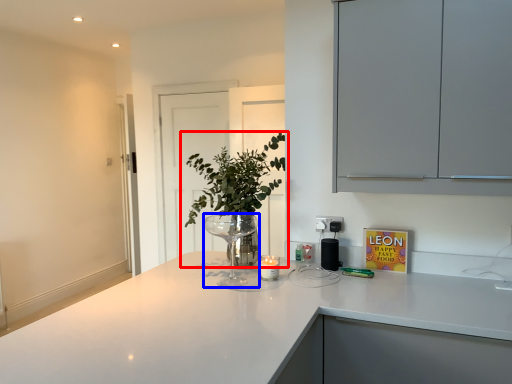
Question: Which object is further to the camera taking this photo, houseplant (highlighted by a red box) or wine glass (highlighted by a blue box)?

Choices:
 (A) houseplant
 (B) wine glass

Answer: (A)